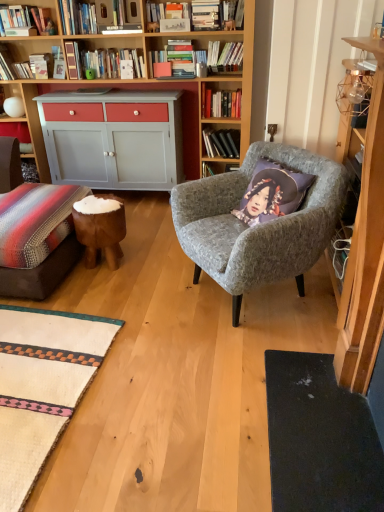
What is the approximate width of hardcover books at upper center, which ranks as the 2th book in right-to-left order?

The width of hardcover books at upper center, which ranks as the 2th book in right-to-left order, is 10.66 inches.

What do you see at coordinates (367, 64) in the screenshot? This screenshot has height=512, width=384. I see `white plastic book at upper right, the 1th book in the bottom-to-top sequence` at bounding box center [367, 64].

The width and height of the screenshot is (384, 512). Describe the element at coordinates (365, 250) in the screenshot. I see `metallic gold cabinet at upper right` at that location.

This screenshot has height=512, width=384. Describe the element at coordinates (100, 228) in the screenshot. I see `brown wooden stool at lower left` at that location.

Find the location of `textured gray armchair at center`. textured gray armchair at center is located at coordinates (259, 224).

How much space does wooden bookshelf at upper left, arranged as the second shelf when viewed from the back, occupy horizontally?

wooden bookshelf at upper left, arranged as the second shelf when viewed from the back, is 6.45 inches wide.

Where is `wooden bookshelf at upper left, the 1th shelf in the top-to-bottom sequence`? Image resolution: width=384 pixels, height=512 pixels. wooden bookshelf at upper left, the 1th shelf in the top-to-bottom sequence is located at coordinates (28, 18).

What is the approximate height of matte gray cabinet at left, the 1th shelf when ordered from bottom to top?

It is 6.98 inches.

This screenshot has height=512, width=384. I want to click on hardcover books at upper center, which is the 3th book from top to bottom, so click(x=220, y=143).

Is brown wooden stool at lower left at the left side of hardcover books at upper center, arranged as the first book when viewed from the left?

Yes, brown wooden stool at lower left is to the left of hardcover books at upper center, arranged as the first book when viewed from the left.

This screenshot has width=384, height=512. Identify the location of table on the left of hardcover books at upper center, the second book positioned from the front. (100, 228).

Is brown wooden stool at lower left facing towards hardcover books at upper center, the second book positioned from the front?

No, brown wooden stool at lower left is not facing towards hardcover books at upper center, the second book positioned from the front.

From the picture: Which object is closer to the camera taking this photo, hardcover books at upper center, arranged as the first book when viewed from the top, or hardcover book at upper center, the 2th book from the top?

hardcover books at upper center, arranged as the first book when viewed from the top.

Locate an element on the screen. Image resolution: width=384 pixels, height=512 pixels. the 1st book located beneath the hardcover books at upper center, the second book positioned from the front (from a real-world perspective) is located at coordinates (220, 103).

Who is bigger, hardcover books at upper center, the second book positioned from the front, or hardcover book at upper center, acting as the 3th book starting from the front?

hardcover book at upper center, acting as the 3th book starting from the front.

Measure the distance from hardcover books at upper center, arranged as the first book when viewed from the left, to hardcover book at upper center, which is the 2th book from left to right.

12.87 inches.

From the image's perspective, between metallic gold cabinet at upper right and hardcover book at upper center, the third book in the right-to-left sequence, which one is located above?

hardcover book at upper center, the third book in the right-to-left sequence, is shown above in the image.

Between metallic gold cabinet at upper right and hardcover book at upper center, the third book in the right-to-left sequence, which one has smaller size?

With smaller size is hardcover book at upper center, the third book in the right-to-left sequence.

What's the angular difference between metallic gold cabinet at upper right and hardcover book at upper center, the 2th book from the top,'s facing directions?

90.9 degrees separate the facing orientations of metallic gold cabinet at upper right and hardcover book at upper center, the 2th book from the top.

Considering the sizes of objects metallic gold cabinet at upper right and hardcover book at upper center, which ranks as the third book in bottom-to-top order, in the image provided, who is shorter, metallic gold cabinet at upper right or hardcover book at upper center, which ranks as the third book in bottom-to-top order,?

With less height is hardcover book at upper center, which ranks as the third book in bottom-to-top order.

Which is more to the left, hardcover book at upper center, which ranks as the third book in bottom-to-top order, or brown wooden stool at lower left?

Positioned to the left is brown wooden stool at lower left.

Between point (217, 98) and point (98, 218), which one is positioned in front?

The point (98, 218) is more forward.

Is brown wooden stool at lower left at the back of hardcover book at upper center, the 2th book from the top?

That's not correct — hardcover book at upper center, the 2th book from the top, is not looking away from brown wooden stool at lower left.

Considering the relative sizes of hardcover book at upper center, which is the 2th book from left to right, and brown wooden stool at lower left in the image provided, is hardcover book at upper center, which is the 2th book from left to right, thinner than brown wooden stool at lower left?

Indeed, hardcover book at upper center, which is the 2th book from left to right, has a lesser width compared to brown wooden stool at lower left.

From the picture: Considering the relative sizes of brown wooden stool at lower left and hardcover books at upper center, which ranks as the second book in bottom-to-top order, in the image provided, is brown wooden stool at lower left wider than hardcover books at upper center, which ranks as the second book in bottom-to-top order,?

Yes.

Is brown wooden stool at lower left in front of or behind hardcover books at upper center, which is the 3th book from top to bottom, in the image?

In the image, brown wooden stool at lower left appears in front of hardcover books at upper center, which is the 3th book from top to bottom.

Does brown wooden stool at lower left have a greater height compared to hardcover books at upper center, which is the 3th book from top to bottom?

Indeed, brown wooden stool at lower left has a greater height compared to hardcover books at upper center, which is the 3th book from top to bottom.

Is point (75, 220) closer or farther from the camera than point (222, 136)?

Point (75, 220) appears to be closer to the viewer than point (222, 136).

How many degrees apart are the facing directions of brown wooden stool at lower left and white plastic book at upper right, placed as the first book when sorted from right to left?

The angular difference between brown wooden stool at lower left and white plastic book at upper right, placed as the first book when sorted from right to left, is 176 degrees.

Does brown wooden stool at lower left appear on the left side of white plastic book at upper right, placed as the first book when sorted from right to left?

Yes.

Could you tell me if brown wooden stool at lower left is turned towards white plastic book at upper right, placed as the first book when sorted from right to left?

No, brown wooden stool at lower left is not oriented towards white plastic book at upper right, placed as the first book when sorted from right to left.

From the image's perspective, is brown wooden stool at lower left located beneath white plastic book at upper right, the fourth book when ordered from left to right?

Correct, brown wooden stool at lower left appears lower than white plastic book at upper right, the fourth book when ordered from left to right, in the image.

Is hardcover books at upper center, the 3th book viewed from the back, facing away from hardcover books at upper center, which is the 3th book from top to bottom?

No.

Which of these two, hardcover books at upper center, arranged as the first book when viewed from the top, or hardcover books at upper center, acting as the 3th book starting from the left, is wider?

hardcover books at upper center, acting as the 3th book starting from the left.

I want to click on the 2nd book to the left of the hardcover books at upper center, arranged as the 4th book when viewed from the front, starting your count from the anchor, so click(173, 60).

Measure the distance from hardcover books at upper center, the fourth book positioned from the right, to hardcover books at upper center, which is the 3th book from top to bottom.

hardcover books at upper center, the fourth book positioned from the right, and hardcover books at upper center, which is the 3th book from top to bottom, are 23.99 inches apart.

You are a GUI agent. You are given a task and a screenshot of the screen. Output one action in this format:
    pyautogui.click(x=<x>, y=<y>)
    Task: Click on the 1st book counting from the right of the brown wooden stool at lower left
    The width and height of the screenshot is (384, 512).
    Given the screenshot: What is the action you would take?
    pyautogui.click(x=173, y=60)

Starting from the hardcover book at upper center, which is the 2th book from left to right, which book is the 1st one in front? Please provide its 2D coordinates.

[(173, 60)]

Estimate the real-world distances between objects in this image. Which object is further from matte gray cabinet at left, which is counted as the 2th shelf, starting from the front, metallic gold cabinet at upper right or hardcover books at upper center, placed as the 4th book when sorted from bottom to top?

The object further to matte gray cabinet at left, which is counted as the 2th shelf, starting from the front, is metallic gold cabinet at upper right.

Which object lies further to the anchor point hardcover books at upper center, arranged as the 4th book when viewed from the front, brown wooden stool at lower left or white plastic book at upper right, arranged as the 4th book when viewed from the top?

white plastic book at upper right, arranged as the 4th book when viewed from the top.

Which object lies further to the anchor point hardcover book at upper center, the third book in the right-to-left sequence, matte gray cabinet at left, which is counted as the 2th shelf, starting from the front, or wooden bookshelf at upper left, which is the second shelf from bottom to top?

Among the two, matte gray cabinet at left, which is counted as the 2th shelf, starting from the front, is located further to hardcover book at upper center, the third book in the right-to-left sequence.

Based on their spatial positions, is hardcover book at upper center, which is the 2th book from left to right, or white plastic book at upper right, the 1th book in the bottom-to-top sequence, further from matte gray cabinet at left, positioned as the 2th shelf in top-to-bottom order?

white plastic book at upper right, the 1th book in the bottom-to-top sequence, is positioned further to the anchor matte gray cabinet at left, positioned as the 2th shelf in top-to-bottom order.

From the image, which object appears to be nearer to matte gray cabinet at left, positioned as the 2th shelf in top-to-bottom order, wooden bookshelf at upper left, the 1th shelf in the top-to-bottom sequence, or textured gray armchair at center?

wooden bookshelf at upper left, the 1th shelf in the top-to-bottom sequence, is positioned closer to the anchor matte gray cabinet at left, positioned as the 2th shelf in top-to-bottom order.

Estimate the real-world distances between objects in this image. Which object is further from hardcover book at upper center, the third book in the right-to-left sequence, white plastic book at upper right, the 4th book in the back-to-front sequence, or metallic gold cabinet at upper right?

metallic gold cabinet at upper right is positioned further to the anchor hardcover book at upper center, the third book in the right-to-left sequence.

Looking at the image, which one is located closer to brown wooden stool at lower left, hardcover books at upper center, which ranks as the second book in bottom-to-top order, or hardcover books at upper center, placed as the 4th book when sorted from bottom to top?

hardcover books at upper center, which ranks as the second book in bottom-to-top order, is closer to brown wooden stool at lower left.

Based on their spatial positions, is hardcover books at upper center, placed as the 4th book when sorted from bottom to top, or wooden bookshelf at upper left, arranged as the second shelf when viewed from the back, further from hardcover books at upper center, which is the 3th book from top to bottom?

wooden bookshelf at upper left, arranged as the second shelf when viewed from the back, lies further to hardcover books at upper center, which is the 3th book from top to bottom, than the other object.

This screenshot has width=384, height=512. Identify the location of shelf between wooden bookshelf at upper left, which is the second shelf from bottom to top, and brown wooden stool at lower left vertically. (18, 135).

The width and height of the screenshot is (384, 512). What are the coordinates of `table between metallic gold cabinet at upper right and hardcover books at upper center, arranged as the first book when viewed from the left, along the z-axis` in the screenshot? It's located at (100, 228).

Locate an element on the screen. The width and height of the screenshot is (384, 512). cabinet between white plastic book at upper right, the 4th book in the back-to-front sequence, and textured gray armchair at center vertically is located at coordinates (365, 250).

Identify the location of table located between white plastic book at upper right, the 4th book in the back-to-front sequence, and hardcover book at upper center, the 2th book from the top, in the depth direction. Image resolution: width=384 pixels, height=512 pixels. (100, 228).